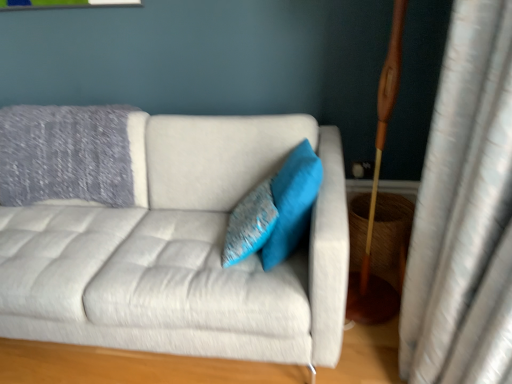
Question: From the image's perspective, relative to textured blue pillow at center, which ranks as the 2th pillow in right-to-left order, is light gray fabric couch at center above or below?

Choices:
 (A) above
 (B) below

Answer: (B)

Question: In the image, is light gray fabric couch at center on the left side or the right side of textured blue pillow at center, which ranks as the 2th pillow in right-to-left order?

Choices:
 (A) right
 (B) left

Answer: (B)

Question: Estimate the real-world distances between objects in this image. Which object is farther from the turquoise fabric pillow at center, which ranks as the 2th pillow in left-to-right order?

Choices:
 (A) textured blue pillow at center, the 1th pillow when ordered from left to right
 (B) light gray fabric couch at center

Answer: (B)

Question: Which is farther from the turquoise fabric pillow at center, which ranks as the 2th pillow in left-to-right order?

Choices:
 (A) textured blue pillow at center, which ranks as the 2th pillow in right-to-left order
 (B) light gray fabric couch at center

Answer: (B)